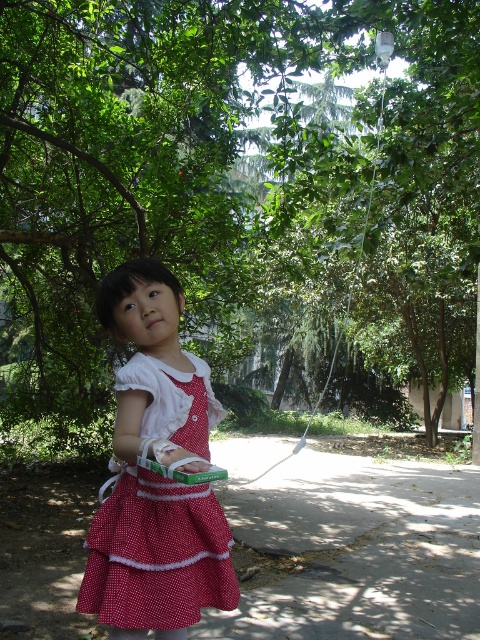
Between point (313, 474) and point (147, 513), which one is positioned behind?

Point (313, 474)

Describe the element at coordinates (357, 550) in the screenshot. This screenshot has height=640, width=480. I see `gray concrete pavement at lower center` at that location.

Describe the element at coordinates (357, 550) in the screenshot. I see `gray concrete pavement at lower center` at that location.

Where is `gray concrete pavement at lower center`? The height and width of the screenshot is (640, 480). gray concrete pavement at lower center is located at coordinates (357, 550).

Consider the image. Can you confirm if green leafy tree at center is thinner than red polka dot dress at center?

No, green leafy tree at center is not thinner than red polka dot dress at center.

At what (x,y) coordinates should I click in order to perform the action: click on green leafy tree at center. Please return your answer as a coordinate pair (x, y). This screenshot has width=480, height=640. Looking at the image, I should click on (238, 186).

Consider the image. Does green leafy tree at center appear on the left side of gray concrete pavement at lower center?

Correct, you'll find green leafy tree at center to the left of gray concrete pavement at lower center.

Is green leafy tree at center to the right of gray concrete pavement at lower center from the viewer's perspective?

In fact, green leafy tree at center is to the left of gray concrete pavement at lower center.

Measure the distance between point [214,13] and camera.

Point [214,13] and camera are 4.54 meters apart from each other.

Where is `green leafy tree at center`? green leafy tree at center is located at coordinates (238, 186).